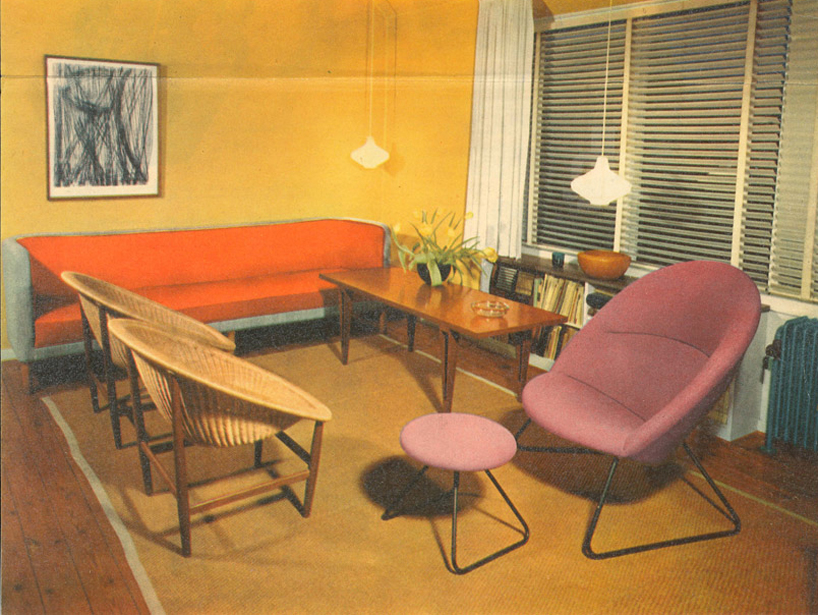
Identify the location of wood panel flooring. (41, 501).